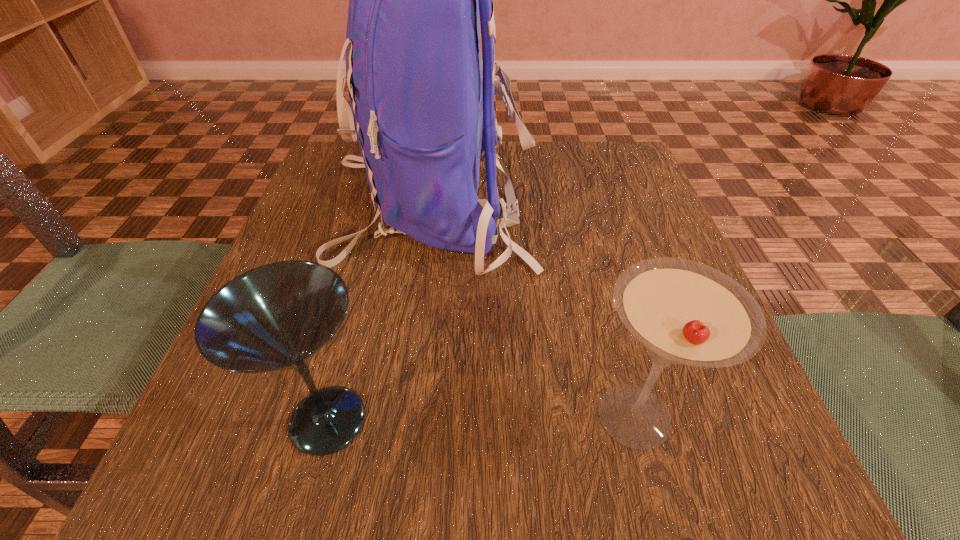
The width and height of the screenshot is (960, 540). Identify the location of object that is positioned at the right edge. (683, 312).

Identify the location of object located at the far left corner. click(x=422, y=118).

This screenshot has width=960, height=540. Identify the location of object present at the near left corner. (277, 316).

Find the location of a particular element. object positioned at the near right corner is located at coordinates (683, 312).

Locate an element on the screen. Image resolution: width=960 pixels, height=540 pixels. vacant region at the near edge of the desktop is located at coordinates (484, 467).

This screenshot has height=540, width=960. In the image, there is a desktop. Find the location of `vacant space at the left edge`. vacant space at the left edge is located at coordinates (337, 213).

The width and height of the screenshot is (960, 540). In the image, there is a desktop. In order to click on vacant area at the right edge in this screenshot , I will do `click(649, 232)`.

Find the location of `free space at the far right corner of the desktop`. free space at the far right corner of the desktop is located at coordinates (607, 153).

At what (x,y) coordinates should I click in order to perform the action: click on blank space at the near right corner of the desktop. Please return your answer as a coordinate pair (x, y). Looking at the image, I should click on (786, 469).

Locate an element on the screen. The height and width of the screenshot is (540, 960). free space between the rightmost object and the farthest object is located at coordinates (533, 310).